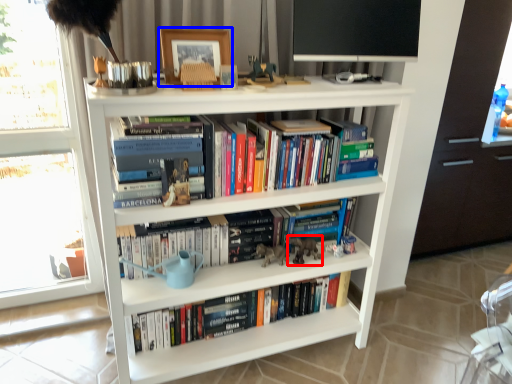
Question: Which point is further to the camera, animal (highlighted by a red box) or picture frame (highlighted by a blue box)?

Choices:
 (A) animal
 (B) picture frame

Answer: (A)